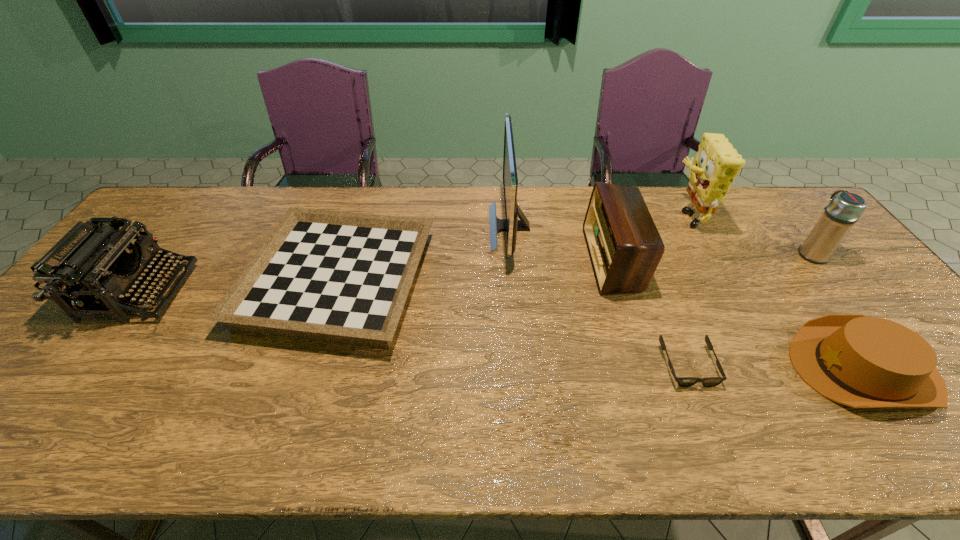
At what (x,y) coordinates should I click in order to perform the action: click on free space located 0.240m on the screen side of the sixth object from right to left. Please return your answer as a coordinate pair (x, y). This screenshot has height=540, width=960. Looking at the image, I should click on (415, 227).

You are a GUI agent. You are given a task and a screenshot of the screen. Output one action in this format:
    pyautogui.click(x=<x>, y=<y>)
    Task: Click on the vacant position located on the face of the sponge
    The height and width of the screenshot is (540, 960).
    Given the screenshot: What is the action you would take?
    pyautogui.click(x=642, y=215)

At what (x,y) coordinates should I click in order to perform the action: click on vacant space located 0.360m on the face of the sponge. Please return your answer as a coordinate pair (x, y). Looking at the image, I should click on (561, 215).

At what (x,y) coordinates should I click in order to perform the action: click on vacant position located 0.250m on the face of the sponge. Please return your answer as a coordinate pair (x, y). Image resolution: width=960 pixels, height=540 pixels. Looking at the image, I should click on (594, 215).

This screenshot has width=960, height=540. I want to click on free space located with a handle on the side of the thermos bottle, so click(765, 195).

Identify the location of free location located 0.230m with a handle on the side of the thermos bottle. The image size is (960, 540). [768, 199].

Locate an element on the screen. This screenshot has height=540, width=960. vacant space located 0.290m with a handle on the side of the thermos bottle is located at coordinates (760, 189).

This screenshot has width=960, height=540. Identify the location of vacant space located 0.340m on the typing side of the leftmost object. (307, 292).

Image resolution: width=960 pixels, height=540 pixels. Find the location of `free space located 0.060m on the front-facing side of the radio receiver`. free space located 0.060m on the front-facing side of the radio receiver is located at coordinates (569, 259).

You are a GUI agent. You are given a task and a screenshot of the screen. Output one action in this format:
    pyautogui.click(x=<x>, y=<y>)
    Task: Click on the free space located 0.380m on the front-facing side of the radio receiver
    
    Given the screenshot: What is the action you would take?
    pyautogui.click(x=462, y=259)